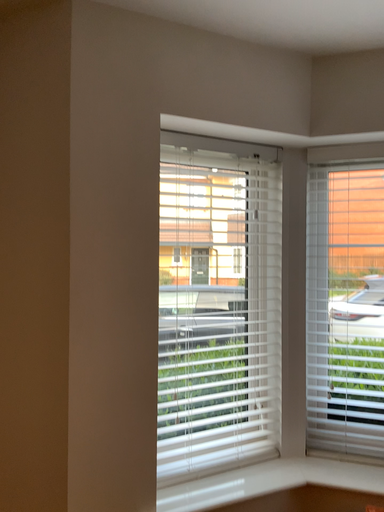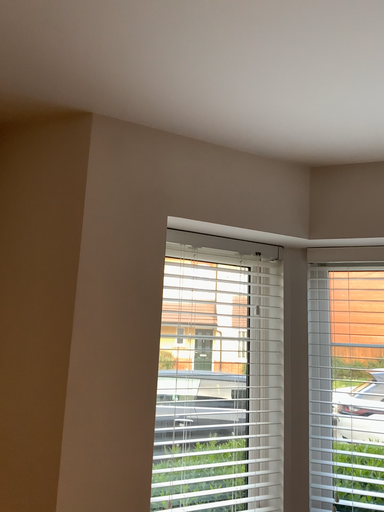
Question: How did the camera likely rotate when shooting the video?

Choices:
 (A) rotated downward
 (B) rotated upward

Answer: (B)